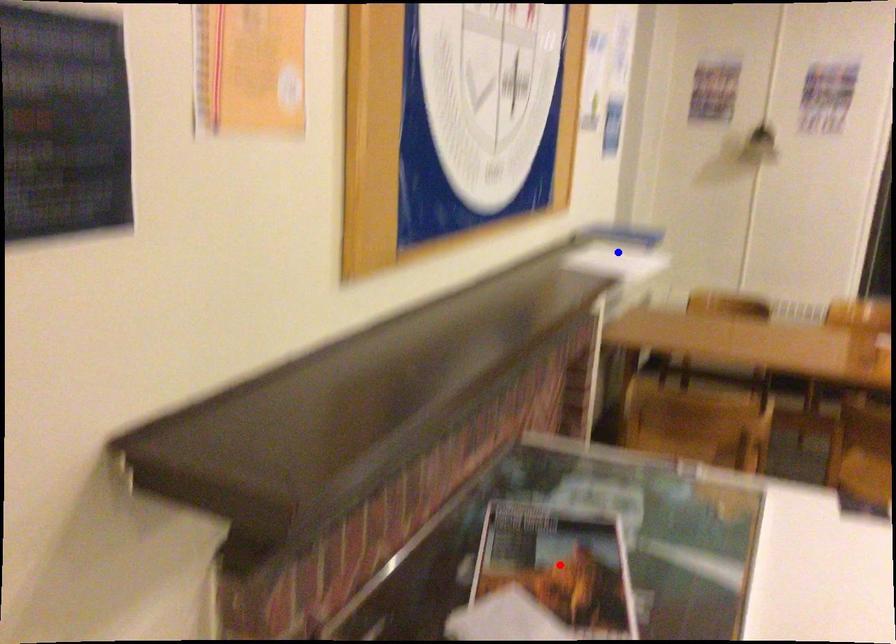
Question: In the image, two points are highlighted. Which point is nearer to the camera? Reply with the corresponding letter.

Choices:
 (A) blue point
 (B) red point

Answer: (B)